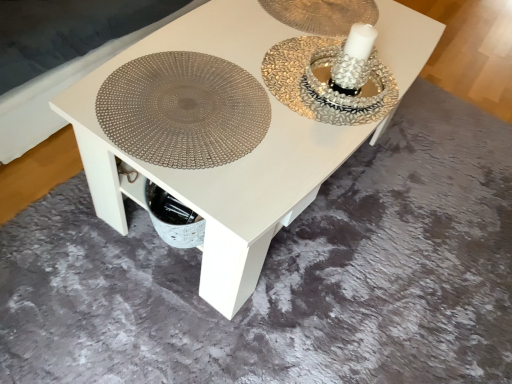
Locate an element on the screen. The width and height of the screenshot is (512, 384). vacant space underneath matte silver platter at center (from a real-world perspective) is located at coordinates (194, 106).